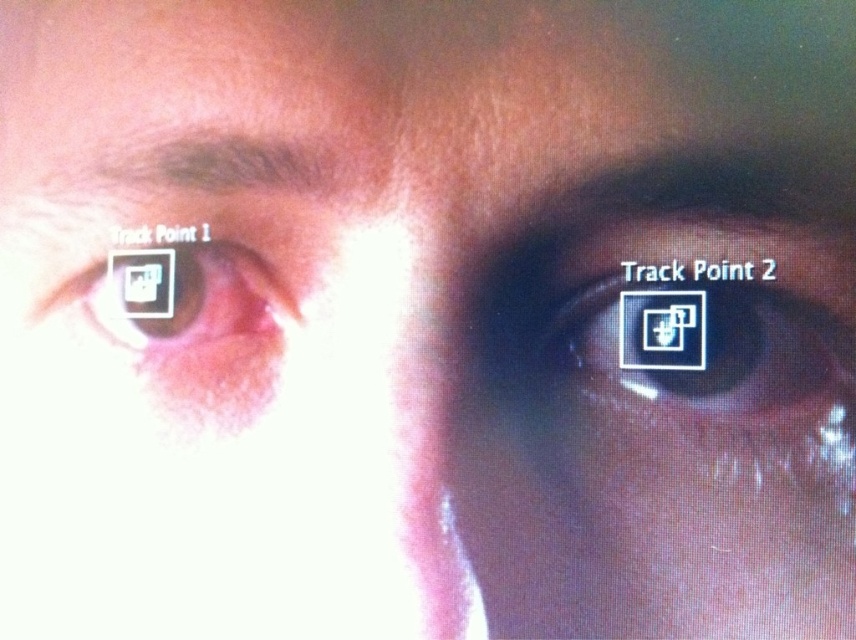
Question: Can you confirm if matte black eye at right is smaller than matte black eye at left?

Choices:
 (A) no
 (B) yes

Answer: (A)

Question: Can you confirm if matte black eye at right is positioned below matte black eye at left?

Choices:
 (A) yes
 (B) no

Answer: (A)

Question: Which object is closer to the camera taking this photo?

Choices:
 (A) matte black eye at left
 (B) matte black eye at right

Answer: (B)

Question: Is matte black eye at right wider than matte black eye at left?

Choices:
 (A) yes
 (B) no

Answer: (B)

Question: Which point is closer to the camera taking this photo?

Choices:
 (A) (777, 333)
 (B) (192, 298)

Answer: (A)